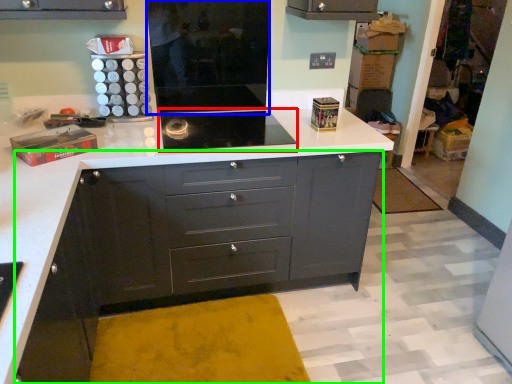
Question: Considering the real-world distances, which object is closest to home appliance (highlighted by a red box)? appliance (highlighted by a blue box) or chest of drawers (highlighted by a green box).

Choices:
 (A) appliance
 (B) chest of drawers

Answer: (A)